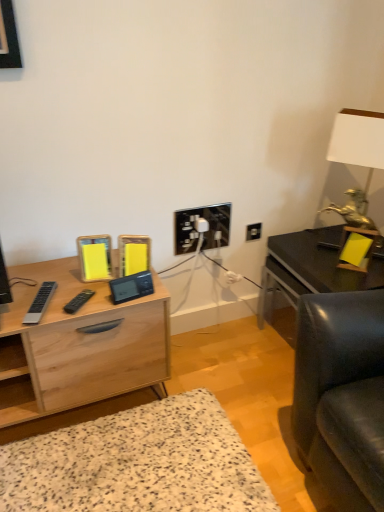
Question: Would you say light wood desk at center is part of matte black table at right's contents?

Choices:
 (A) yes
 (B) no

Answer: (B)

Question: Can you confirm if matte black table at right is shorter than light wood desk at center?

Choices:
 (A) no
 (B) yes

Answer: (A)

Question: Considering the relative sizes of matte black table at right and light wood desk at center in the image provided, is matte black table at right smaller than light wood desk at center?

Choices:
 (A) no
 (B) yes

Answer: (B)

Question: Is matte black table at right wider than light wood desk at center?

Choices:
 (A) no
 (B) yes

Answer: (B)

Question: Would you consider matte black table at right to be distant from light wood desk at center?

Choices:
 (A) yes
 (B) no

Answer: (B)

Question: From a real-world perspective, is white matte table lamp at upper right positioned above or below light wood desk at center?

Choices:
 (A) above
 (B) below

Answer: (A)

Question: In terms of width, does white matte table lamp at upper right look wider or thinner when compared to light wood desk at center?

Choices:
 (A) wide
 (B) thin

Answer: (B)

Question: Based on their sizes in the image, would you say white matte table lamp at upper right is bigger or smaller than light wood desk at center?

Choices:
 (A) big
 (B) small

Answer: (B)

Question: Visually, is white matte table lamp at upper right positioned to the left or to the right of light wood desk at center?

Choices:
 (A) left
 (B) right

Answer: (B)

Question: Is matte black table at right to the left or to the right of black plastic electric outlet at center in the image?

Choices:
 (A) right
 (B) left

Answer: (A)

Question: Considering the positions of matte black table at right and black plastic electric outlet at center in the image, is matte black table at right wider or thinner than black plastic electric outlet at center?

Choices:
 (A) thin
 (B) wide

Answer: (B)

Question: From the image's perspective, is matte black table at right positioned above or below black plastic electric outlet at center?

Choices:
 (A) above
 (B) below

Answer: (B)

Question: Considering the positions of matte black table at right and black plastic electric outlet at center in the image, is matte black table at right bigger or smaller than black plastic electric outlet at center?

Choices:
 (A) small
 (B) big

Answer: (B)

Question: Considering the positions of black plastic electric outlet at center and light wood desk at center in the image, is black plastic electric outlet at center taller or shorter than light wood desk at center?

Choices:
 (A) tall
 (B) short

Answer: (B)

Question: Is point (248, 231) positioned closer to the camera than point (28, 388)?

Choices:
 (A) closer
 (B) farther

Answer: (B)